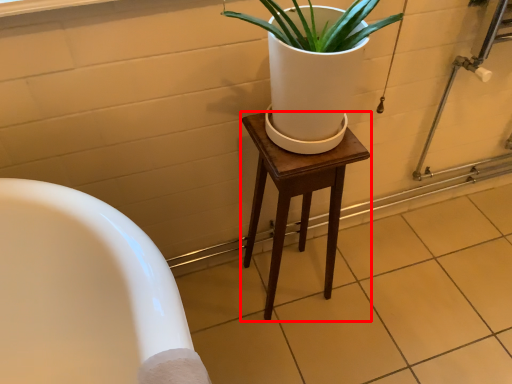
Question: From the image's perspective, where is stool (annotated by the red box) located relative to tile?

Choices:
 (A) below
 (B) above

Answer: (B)